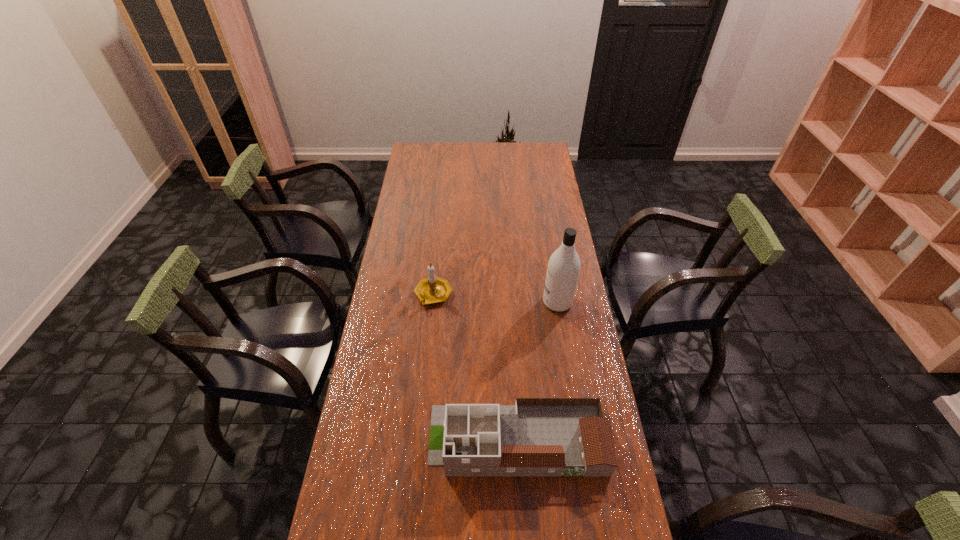
Locate an element on the screen. The height and width of the screenshot is (540, 960). empty space between the candle holder and the tallest object is located at coordinates coord(495,299).

You are a GUI agent. You are given a task and a screenshot of the screen. Output one action in this format:
    pyautogui.click(x=<x>, y=<y>)
    Task: Click on the free space between the nearest object and the tallest object
    The height and width of the screenshot is (540, 960).
    Given the screenshot: What is the action you would take?
    pyautogui.click(x=538, y=371)

I want to click on vacant area that lies between the candle holder and the nearest object, so click(x=475, y=367).

I want to click on object that is the second closest to the shampoo, so click(x=537, y=436).

Identify which object is the nearest to the dollhouse. Please provide its 2D coordinates. Your answer should be formatted as a tuple, i.e. [(x, y)], where the tuple contains the x and y coordinates of a point satisfying the conditions above.

[(563, 269)]